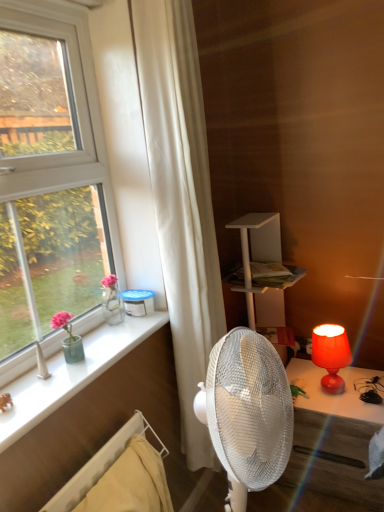
At what (x,y) coordinates should I click in order to perform the action: click on free space above white glossy window sill at lower left (from a real-world perspective). Please return your answer as a coordinate pair (x, y). The height and width of the screenshot is (512, 384). Looking at the image, I should click on (66, 367).